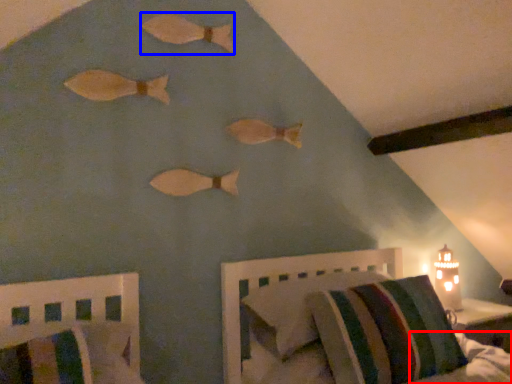
Question: Among these objects, which one is nearest to the camera, mattress (highlighted by a red box) or animal (highlighted by a blue box)?

Choices:
 (A) mattress
 (B) animal

Answer: (B)